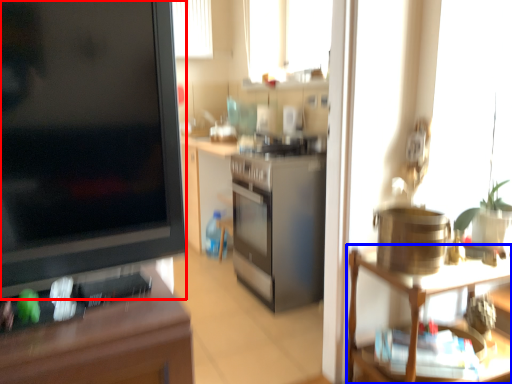
Question: Which object appears closest to the camera in this image, desk (highlighted by a red box) or shelf (highlighted by a blue box)?

Choices:
 (A) desk
 (B) shelf

Answer: (A)